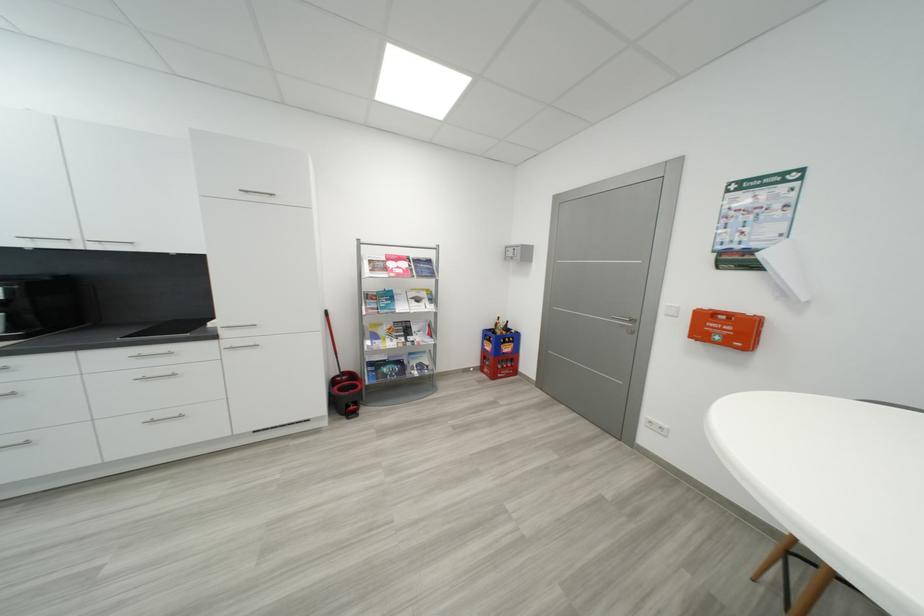
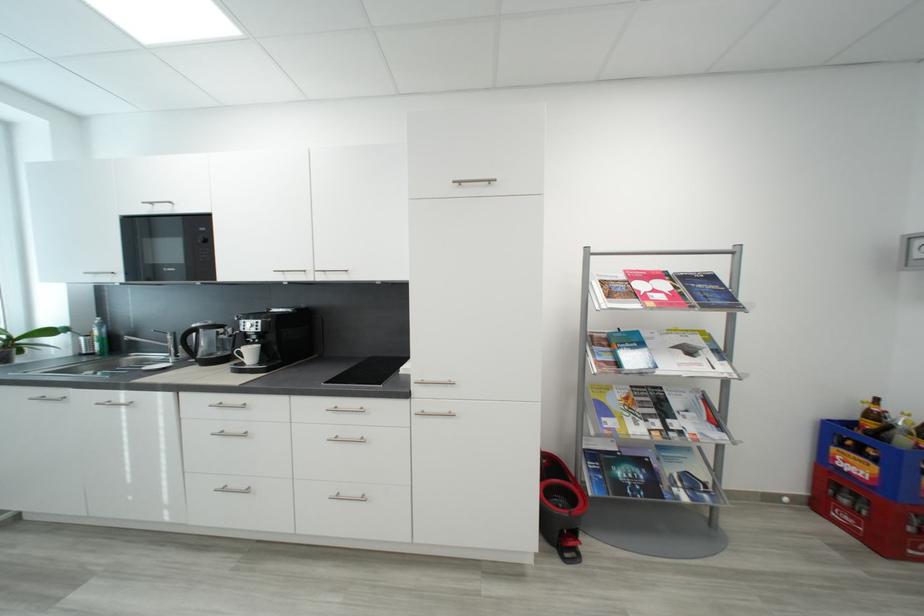
Where in the second image is the point corresponding to pixel 407 363 from the first image?

(650, 464)